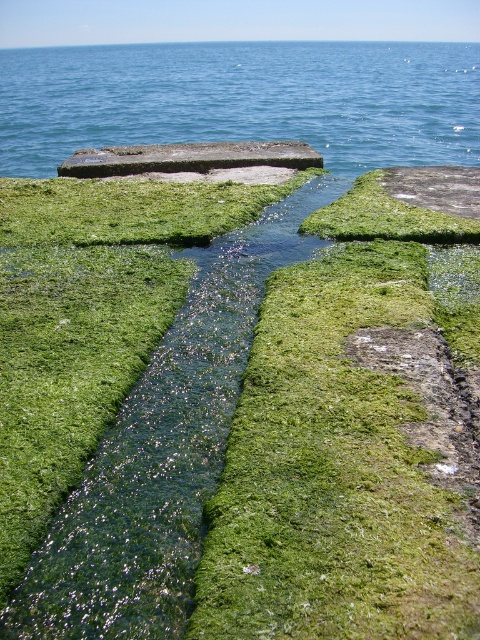
You are standing at the edge of the stream and want to cross to the other side. You see the green mossy grass at center and the smooth concrete slab at center. Which one is closer to you and safer to step on?

The green mossy grass at center is in front of the smooth concrete slab at center, so it is closer. However, stepping on the smooth concrete slab at center would be safer as it provides a stable surface compared to the slippery mossy grass.

From the picture: You are a photographer planning to capture the blue water at upper center and the green mossy grass at center in a single shot. Which of the two elements will occupy a larger portion of the photo?

The blue water at upper center is bigger than the green mossy grass at center, so it will occupy a larger portion of the photo.

You are a gardener who wants to plant a new flower in the scene. You have two options for planting locations based on the height of the green mossy grass at center and the smooth concrete slab at center. Which location would you choose if you want the flower to grow taller?

The smooth concrete slab at center is taller than the green mossy grass at center, so planting the flower on the smooth concrete slab at center would provide a better chance for it to grow taller.